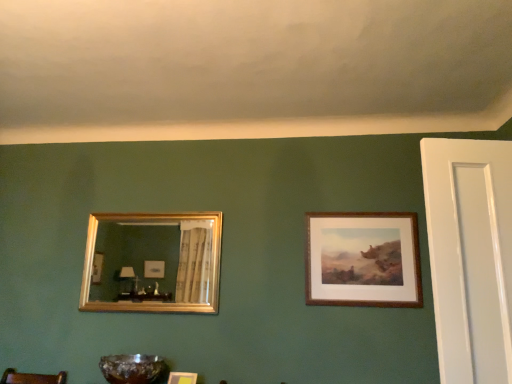
Question: Can you confirm if wooden picture frame at lower center, which is the 2th picture frame from left to right, is wider than gold-framed mirror at left, which is the first picture frame from left to right?

Choices:
 (A) yes
 (B) no

Answer: (A)

Question: From the image's perspective, is wooden picture frame at lower center, which is the 2th picture frame from left to right, located above gold-framed mirror at left, which is the first picture frame from left to right?

Choices:
 (A) yes
 (B) no

Answer: (B)

Question: Is gold-framed mirror at left, which is the first picture frame from left to right, inside wooden picture frame at lower center, which is counted as the second picture frame, starting from the right?

Choices:
 (A) no
 (B) yes

Answer: (A)

Question: Is wooden picture frame at lower center, which is the 2th picture frame from left to right, taller than gold-framed mirror at left, which is the first picture frame from left to right?

Choices:
 (A) yes
 (B) no

Answer: (B)

Question: Is wooden picture frame at lower center, which is counted as the second picture frame, starting from the right, looking in the opposite direction of gold-framed mirror at left, which is the first picture frame from left to right?

Choices:
 (A) yes
 (B) no

Answer: (B)

Question: From a real-world perspective, is translucent amber glass bowl at lower center above or below wooden picture frame at lower center, which is counted as the second picture frame, starting from the right?

Choices:
 (A) above
 (B) below

Answer: (A)

Question: Does point (159, 359) appear closer or farther from the camera than point (194, 375)?

Choices:
 (A) farther
 (B) closer

Answer: (A)

Question: Is translucent amber glass bowl at lower center taller or shorter than wooden picture frame at lower center, which is the 2th picture frame from left to right?

Choices:
 (A) tall
 (B) short

Answer: (A)

Question: Relative to wooden picture frame at lower center, which is the 2th picture frame from left to right, is translucent amber glass bowl at lower center in front or behind?

Choices:
 (A) front
 (B) behind

Answer: (A)

Question: From the image's perspective, is wooden picture frame at lower center, which is counted as the second picture frame, starting from the right, located above or below translucent amber glass bowl at lower center?

Choices:
 (A) above
 (B) below

Answer: (B)

Question: Is point (179, 372) positioned closer to the camera than point (117, 365)?

Choices:
 (A) closer
 (B) farther

Answer: (B)

Question: Considering their positions, is wooden picture frame at lower center, which is the 2th picture frame from left to right, located in front of or behind translucent amber glass bowl at lower center?

Choices:
 (A) behind
 (B) front

Answer: (A)

Question: Is wooden picture frame at lower center, which is the 2th picture frame from left to right, wider or thinner than translucent amber glass bowl at lower center?

Choices:
 (A) thin
 (B) wide

Answer: (A)

Question: Considering the relative positions of wooden picture frame at lower center, which is counted as the second picture frame, starting from the right, and brown wooden frame at upper right, marked as the third picture frame in a left-to-right arrangement, in the image provided, is wooden picture frame at lower center, which is counted as the second picture frame, starting from the right, to the left or to the right of brown wooden frame at upper right, marked as the third picture frame in a left-to-right arrangement,?

Choices:
 (A) right
 (B) left

Answer: (B)

Question: In terms of size, does wooden picture frame at lower center, which is the 2th picture frame from left to right, appear bigger or smaller than brown wooden frame at upper right, marked as the third picture frame in a left-to-right arrangement?

Choices:
 (A) big
 (B) small

Answer: (B)